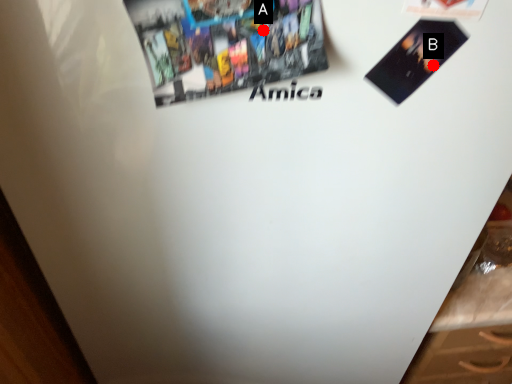
Question: Two points are circled on the image, labeled by A and B beside each circle. Which of the following is the farthest from the observer?

Choices:
 (A) A is further
 (B) B is further

Answer: (B)